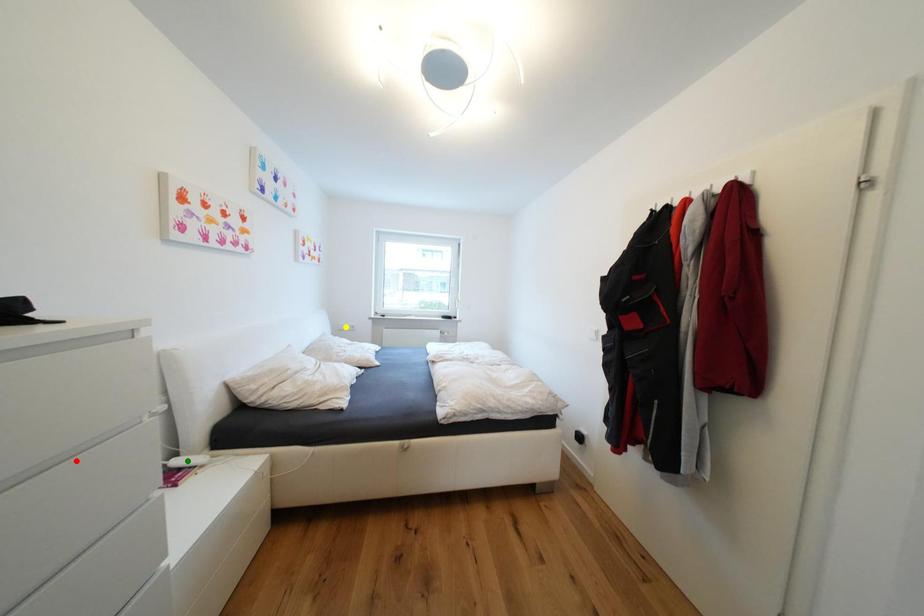
Order these from farthest to nearest:
green point
yellow point
red point

yellow point, green point, red point